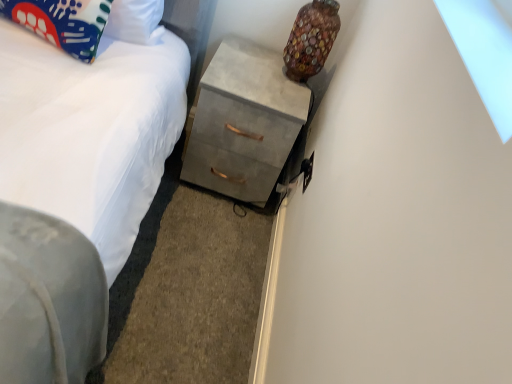
The image size is (512, 384). Find the location of `vacant space in front of multicolored glass vase at upper right`. vacant space in front of multicolored glass vase at upper right is located at coordinates (266, 87).